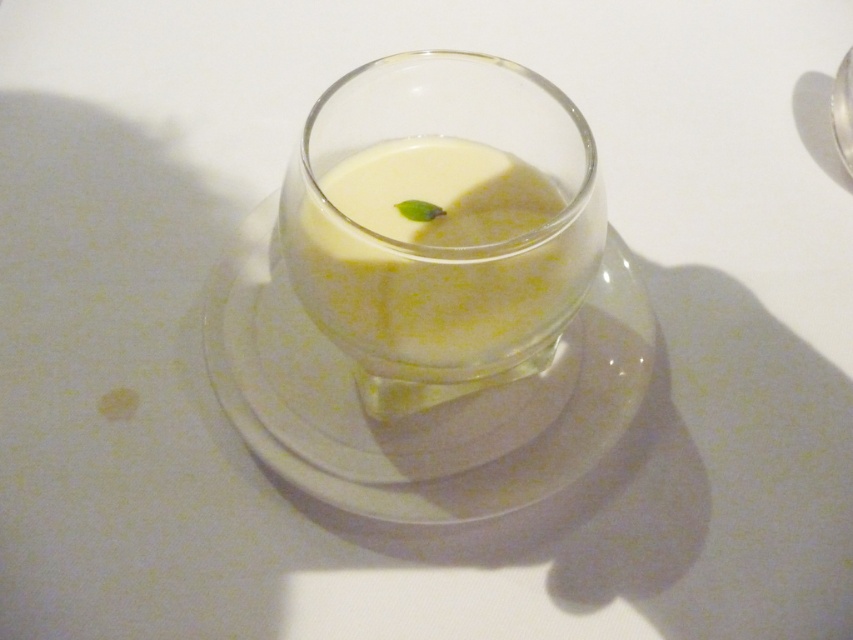
Is white glossy plate at center positioned before white opaque glass at center?

No, it is not.

Is white glossy plate at center to the right of white opaque glass at center from the viewer's perspective?

No, white glossy plate at center is not to the right of white opaque glass at center.

Who is more distant from viewer, [437,436] or [404,307]?

The point [437,436] is more distant.

Where is `white glossy plate at center`? white glossy plate at center is located at coordinates tap(421, 413).